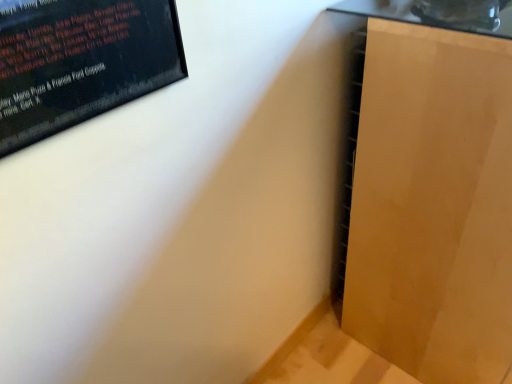
This screenshot has height=384, width=512. What do you see at coordinates (430, 188) in the screenshot?
I see `light brown wood cabinet at right` at bounding box center [430, 188].

The height and width of the screenshot is (384, 512). What are the coordinates of `light brown wood cabinet at right` in the screenshot? It's located at (430, 188).

At what (x,y) coordinates should I click in order to perform the action: click on light brown wood cabinet at right. Please return your answer as a coordinate pair (x, y). The width and height of the screenshot is (512, 384). Looking at the image, I should click on (430, 188).